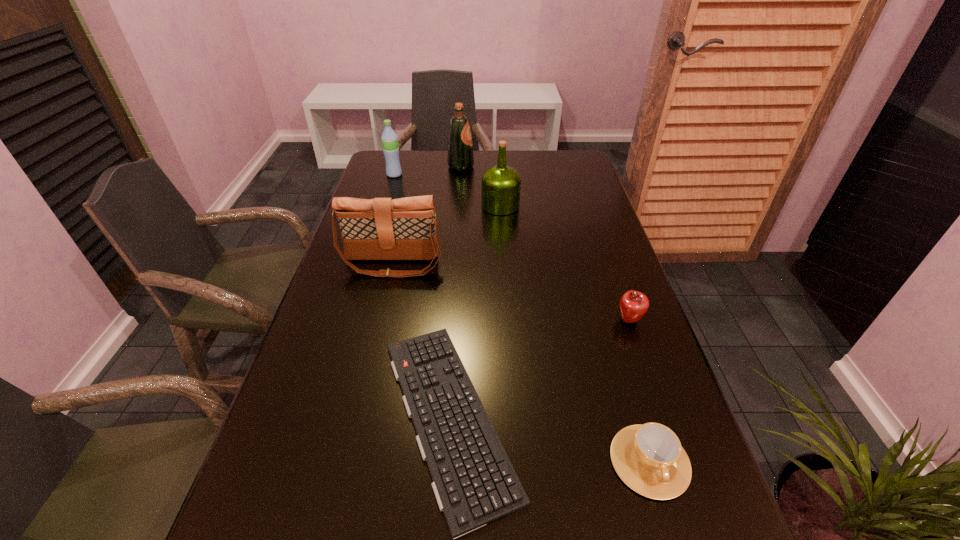
At what (x,y) coordinates should I click in order to perform the action: click on cup at the right edge. Please return your answer as a coordinate pair (x, y). Image resolution: width=960 pixels, height=540 pixels. Looking at the image, I should click on tap(649, 458).

Find the location of a particular element. The width and height of the screenshot is (960, 540). object positioned at the far left corner is located at coordinates (389, 138).

In order to click on vacant region at the left edge of the desktop in this screenshot , I will do coord(362,372).

Locate an element on the screen. The height and width of the screenshot is (540, 960). free space at the right edge is located at coordinates (559, 188).

I want to click on vacant area at the far left corner of the desktop, so click(378, 165).

Identify the location of vacant region between the computer keyboard and the third shortest object. This screenshot has width=960, height=540. pyautogui.click(x=539, y=368).

Where is `vacant point located between the third farthest object and the computer keyboard`? The width and height of the screenshot is (960, 540). vacant point located between the third farthest object and the computer keyboard is located at coordinates (474, 310).

Find the location of a particular element. vacant space that's between the fifth tallest object and the right olive oil is located at coordinates (564, 263).

Identify the location of unoccupied position between the second shortest object and the farther olive oil. (555, 314).

The height and width of the screenshot is (540, 960). I want to click on vacant area that lies between the water bottle and the left olive oil, so tap(427, 171).